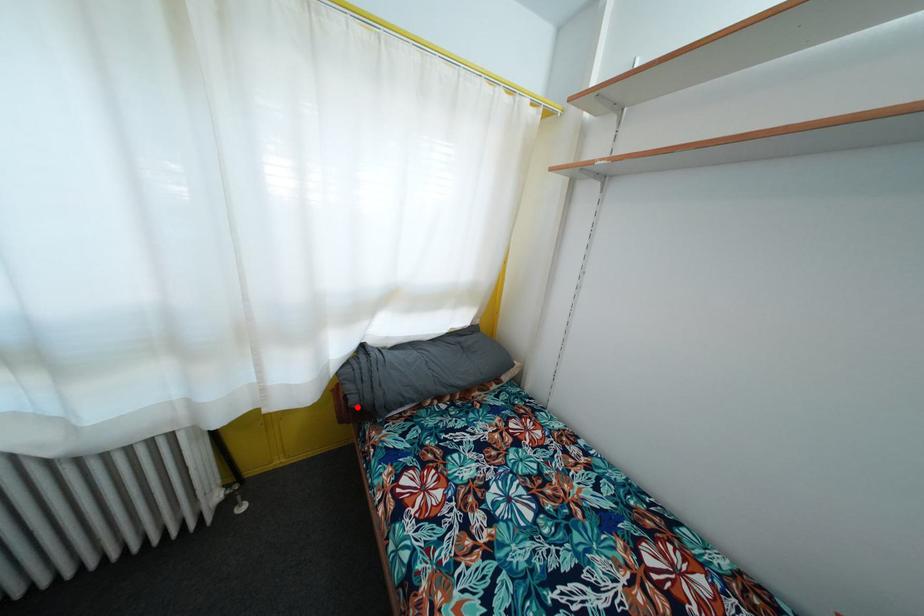
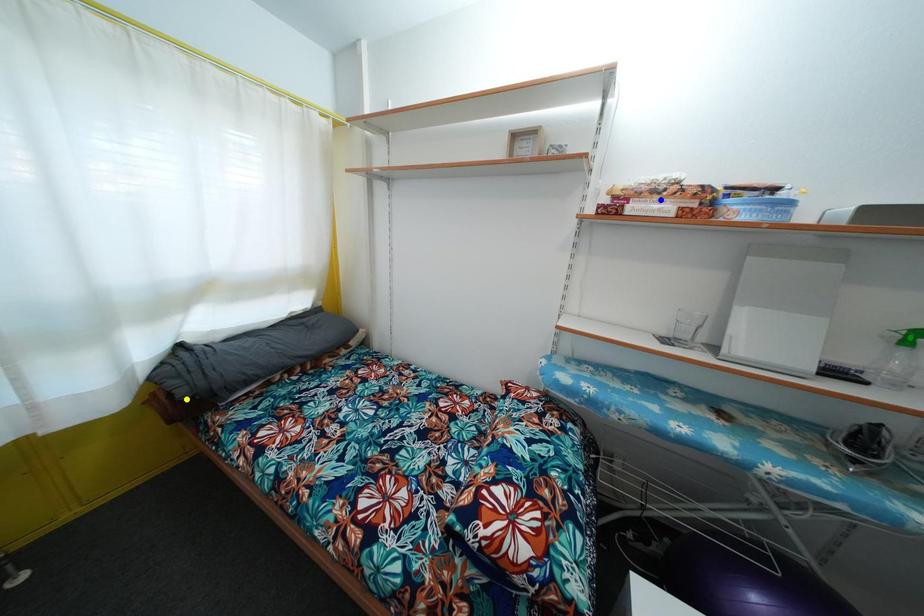
Question: I am providing you with two images of the same scene from different viewpoints. A red point is marked on the first image. You are given multiple points on the second image. Can you choose the point in image 2 that corresponds to the point in image 1?

Choices:
 (A) yellow point
 (B) blue point
 (C) green point

Answer: (A)